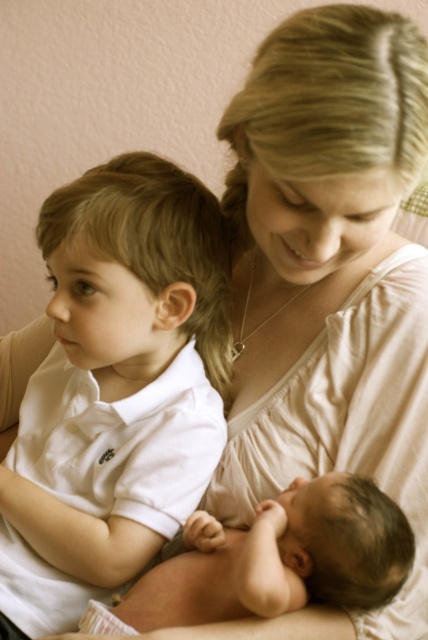
Between white cotton shirt at left and smooth skin baby at center, which one is positioned higher?

white cotton shirt at left

Can you confirm if white cotton shirt at left is thinner than smooth skin baby at center?

Correct, white cotton shirt at left's width is less than smooth skin baby at center's.

What do you see at coordinates (115, 387) in the screenshot?
I see `white cotton shirt at left` at bounding box center [115, 387].

This screenshot has height=640, width=428. I want to click on white cotton shirt at left, so click(115, 387).